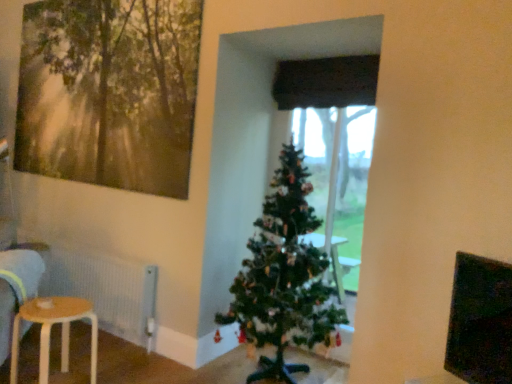
Question: Could green matte christmas tree at center be considered to be inside black fabric curtain at center?

Choices:
 (A) no
 (B) yes

Answer: (A)

Question: From the image's perspective, is black fabric curtain at center beneath green matte christmas tree at center?

Choices:
 (A) yes
 (B) no

Answer: (B)

Question: Is black fabric curtain at center to the left of green matte christmas tree at center from the viewer's perspective?

Choices:
 (A) yes
 (B) no

Answer: (B)

Question: Considering the relative sizes of black fabric curtain at center and green matte christmas tree at center in the image provided, is black fabric curtain at center wider than green matte christmas tree at center?

Choices:
 (A) yes
 (B) no

Answer: (B)

Question: Is black fabric curtain at center taller than green matte christmas tree at center?

Choices:
 (A) no
 (B) yes

Answer: (A)

Question: From their relative heights in the image, would you say black matte window screen at upper right is taller or shorter than white textured radiator at lower left?

Choices:
 (A) tall
 (B) short

Answer: (B)

Question: From the image's perspective, relative to white textured radiator at lower left, is black matte window screen at upper right above or below?

Choices:
 (A) below
 (B) above

Answer: (B)

Question: Is black matte window screen at upper right to the left or to the right of white textured radiator at lower left in the image?

Choices:
 (A) left
 (B) right

Answer: (B)

Question: Considering the positions of black matte window screen at upper right and white textured radiator at lower left in the image, is black matte window screen at upper right bigger or smaller than white textured radiator at lower left?

Choices:
 (A) big
 (B) small

Answer: (B)

Question: Would you say white textured radiator at lower left is to the left or to the right of black fabric curtain at center in the picture?

Choices:
 (A) right
 (B) left

Answer: (B)

Question: Considering the positions of point (101, 261) and point (376, 62), is point (101, 261) closer or farther from the camera than point (376, 62)?

Choices:
 (A) closer
 (B) farther

Answer: (B)

Question: Is white textured radiator at lower left in front of or behind black fabric curtain at center in the image?

Choices:
 (A) behind
 (B) front

Answer: (A)

Question: Looking at the image, does white textured radiator at lower left seem bigger or smaller compared to black fabric curtain at center?

Choices:
 (A) big
 (B) small

Answer: (A)

Question: Considering their positions, is green matte christmas tree at center located in front of or behind light brown wooden stool at lower left?

Choices:
 (A) front
 (B) behind

Answer: (A)

Question: Choose the correct answer: Is green matte christmas tree at center inside light brown wooden stool at lower left or outside it?

Choices:
 (A) inside
 (B) outside

Answer: (B)